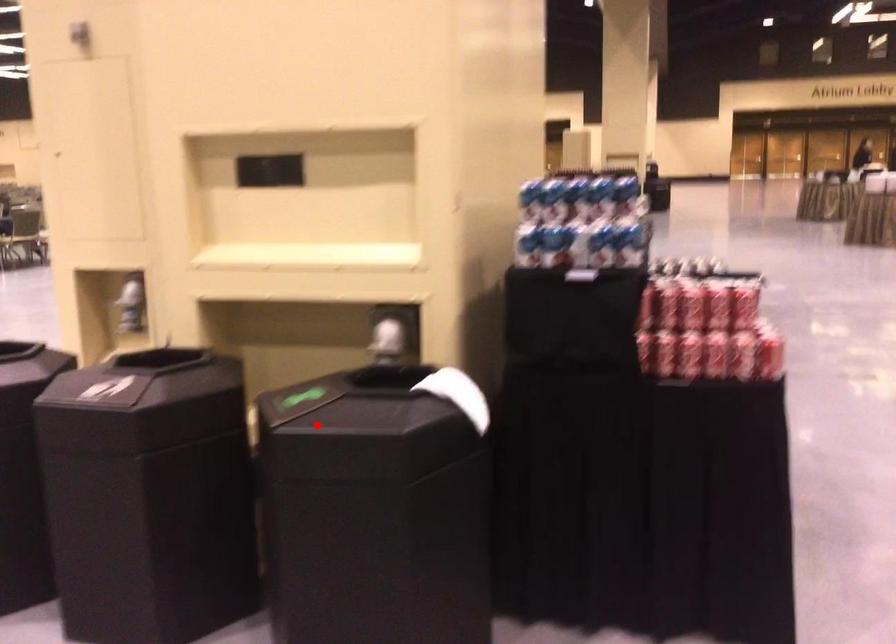
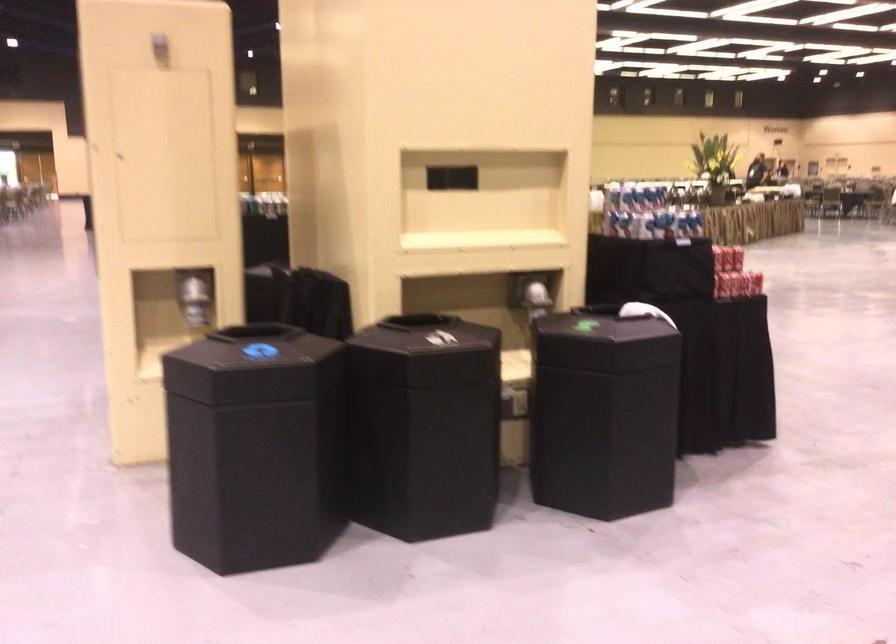
Question: I am providing you with two images of the same scene from different viewpoints. In image1, a red point is highlighted. Considering the same 3D point in image2, which of the following is correct?

Choices:
 (A) It is closer
 (B) It is farther

Answer: (B)